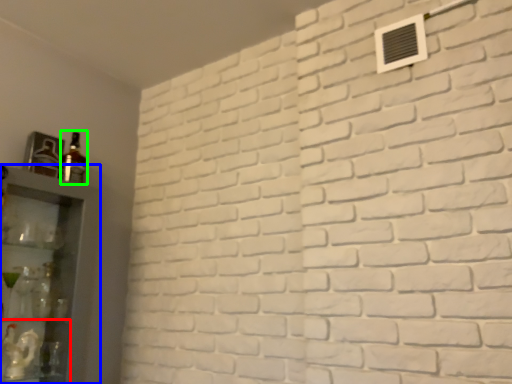
Question: Based on their relative distances, which object is nearer to shelf (highlighted by a red box)? Choose from shelf (highlighted by a blue box) and bottle (highlighted by a green box).

Choices:
 (A) shelf
 (B) bottle

Answer: (A)